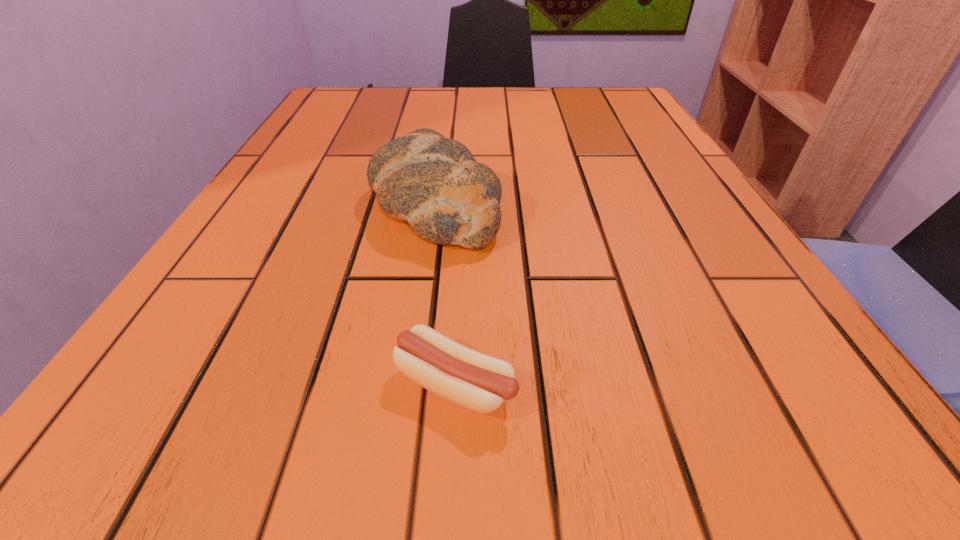
Find the location of a particular element. free space at the right edge is located at coordinates (677, 289).

Identify the location of vacant space at the far left corner of the desktop. This screenshot has height=540, width=960. (315, 123).

Image resolution: width=960 pixels, height=540 pixels. In order to click on vacant space at the near left corner of the desktop in this screenshot , I will do `click(126, 455)`.

The height and width of the screenshot is (540, 960). In the image, there is a desktop. Find the location of `free space at the far right corner`. free space at the far right corner is located at coordinates (566, 93).

At what (x,y) coordinates should I click in order to perform the action: click on vacant space at the near right corner of the desktop. Please return your answer as a coordinate pair (x, y). This screenshot has width=960, height=540. Looking at the image, I should click on (763, 392).

I want to click on vacant region that satisfies the following two spatial constraints: 1. on the front side of the taller object; 2. on the left side of the sausage, so click(x=408, y=383).

The height and width of the screenshot is (540, 960). I want to click on free space that satisfies the following two spatial constraints: 1. on the front side of the taller object; 2. on the right side of the nearer object, so click(408, 383).

Where is `vacant space that satisfies the following two spatial constraints: 1. on the front side of the farther object; 2. on the right side of the sausage`? vacant space that satisfies the following two spatial constraints: 1. on the front side of the farther object; 2. on the right side of the sausage is located at coordinates (408, 383).

The height and width of the screenshot is (540, 960). In order to click on free space that satisfies the following two spatial constraints: 1. on the front side of the shorter object; 2. on the right side of the taller object in this screenshot , I will do `click(408, 383)`.